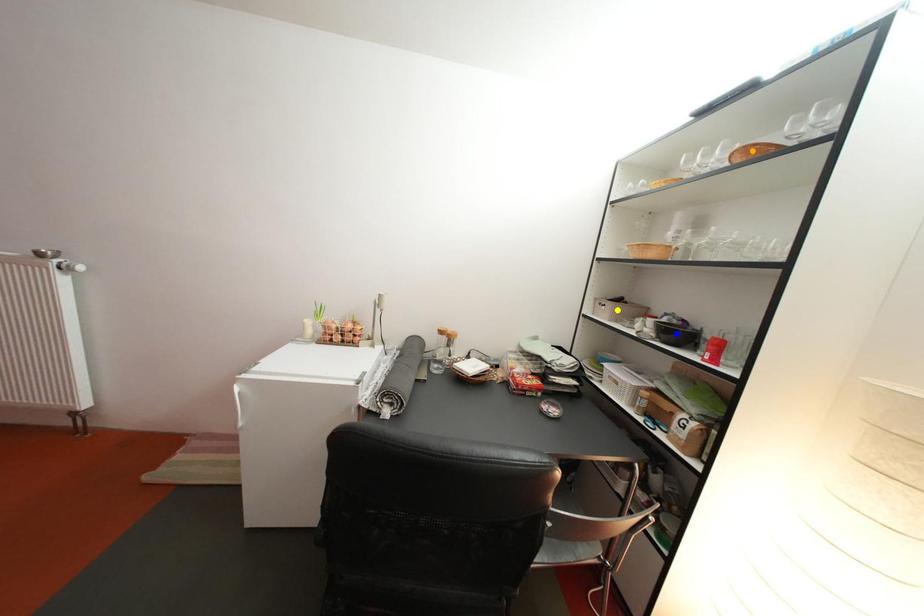
Order these from nearest to farthest:
yellow point
orange point
blue point

yellow point
blue point
orange point